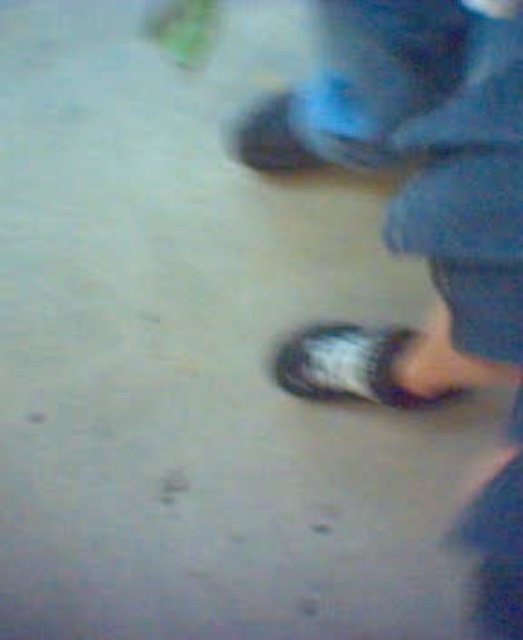
You are standing in an outdoor area with a blurry image. You see a point at coordinates (433, 230). What object is located at this point?

The point at coordinates (433, 230) corresponds to black rubber sandals at lower center.

You are standing in an outdoor area and see the black rubber sandals at lower center and the matte blue shoe at upper center. Which object is positioned more to the right side?

The black rubber sandals at lower center is positioned more to the right side than the matte blue shoe at upper center.